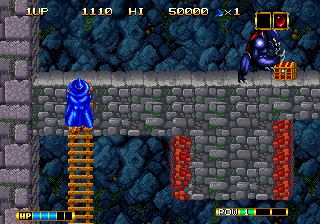
At what (x,y) coordinates should I click in order to perform the action: click on chest. Please return your answer as a coordinate pair (x, y). This screenshot has width=320, height=224. Looking at the image, I should click on (291, 70).